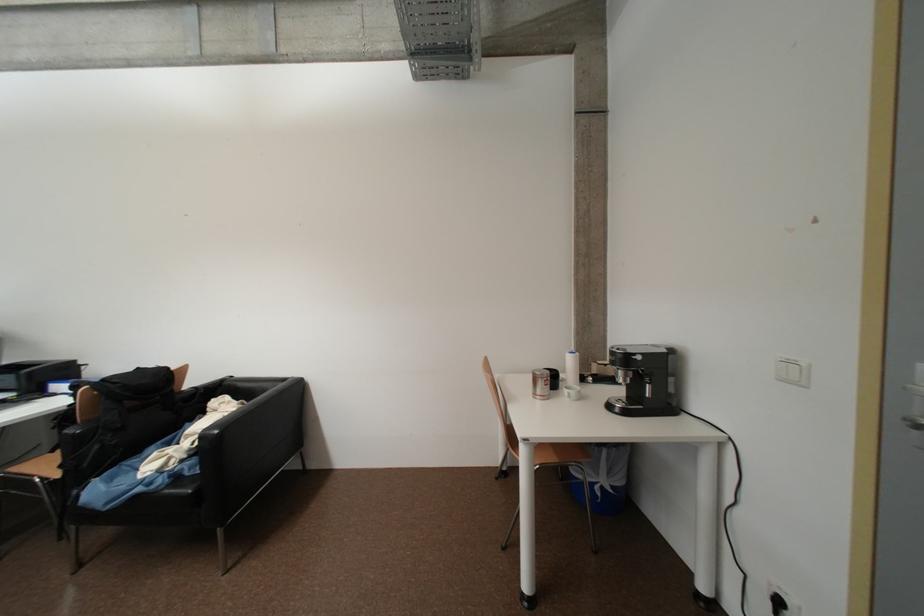
Find where to lift the silver coffee can. Please return your answer as a coordinate pair (x, y).

(541, 384)